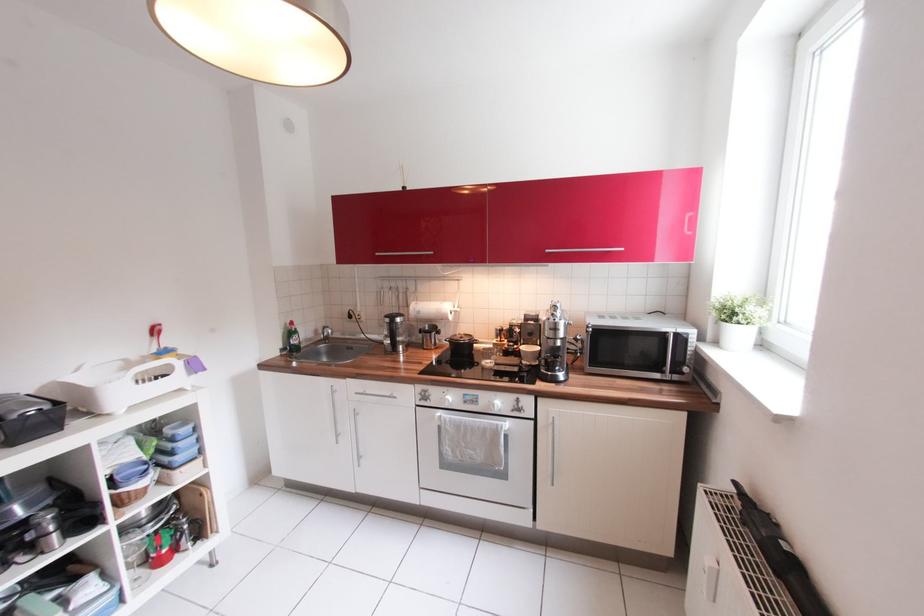
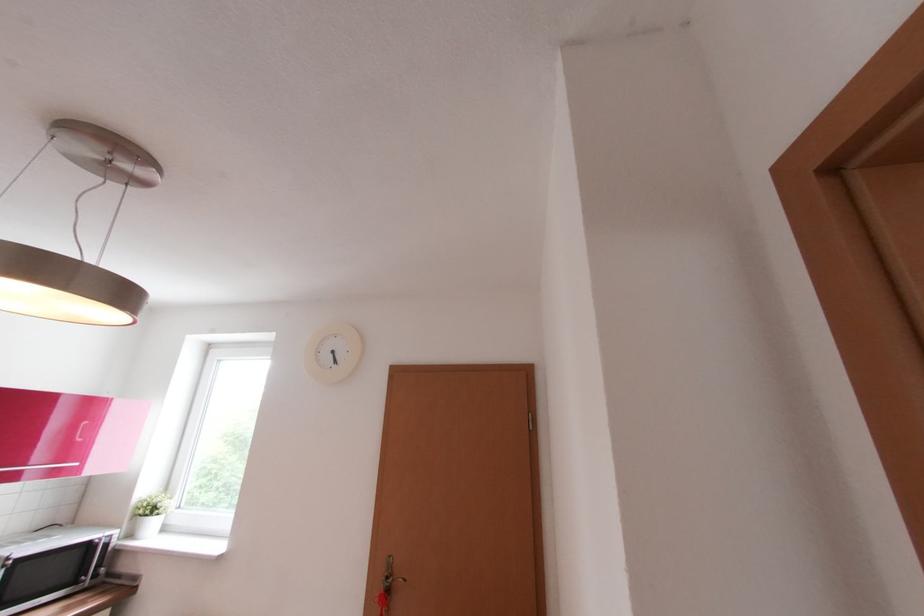
Where in the second image is the point corresponding to the point at 735,322 from the first image?

(155, 516)